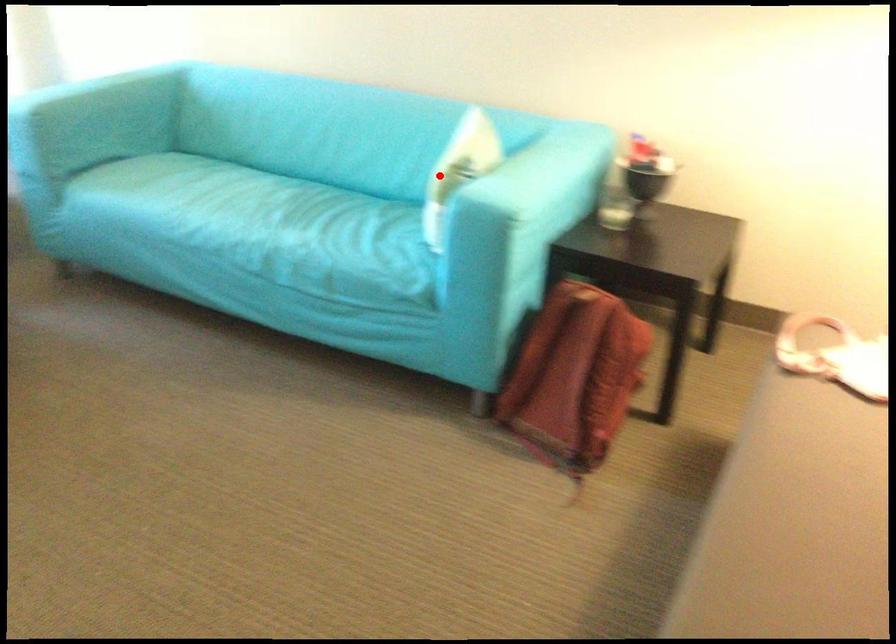
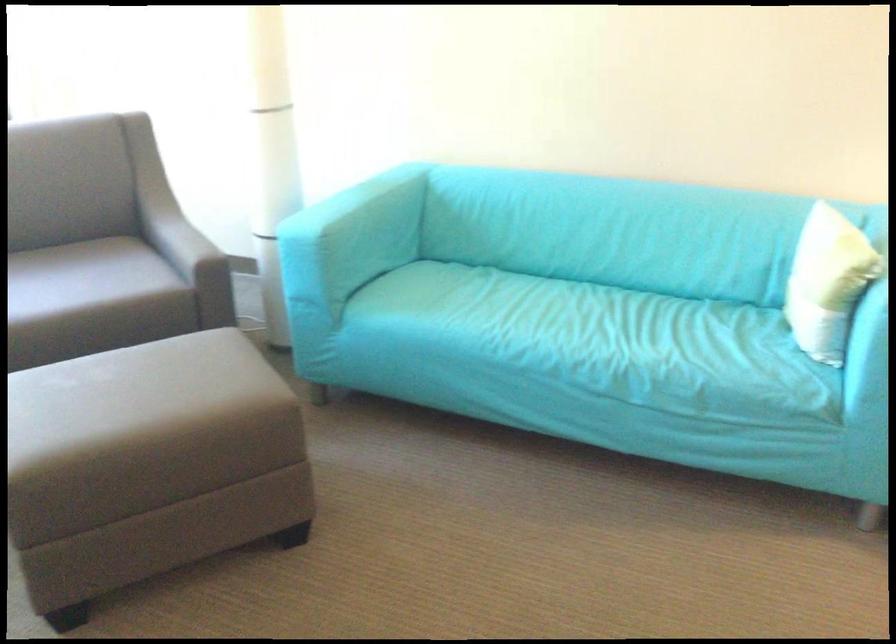
The point at the highlighted location is marked in the first image. Where is the corresponding point in the second image?

(825, 281)